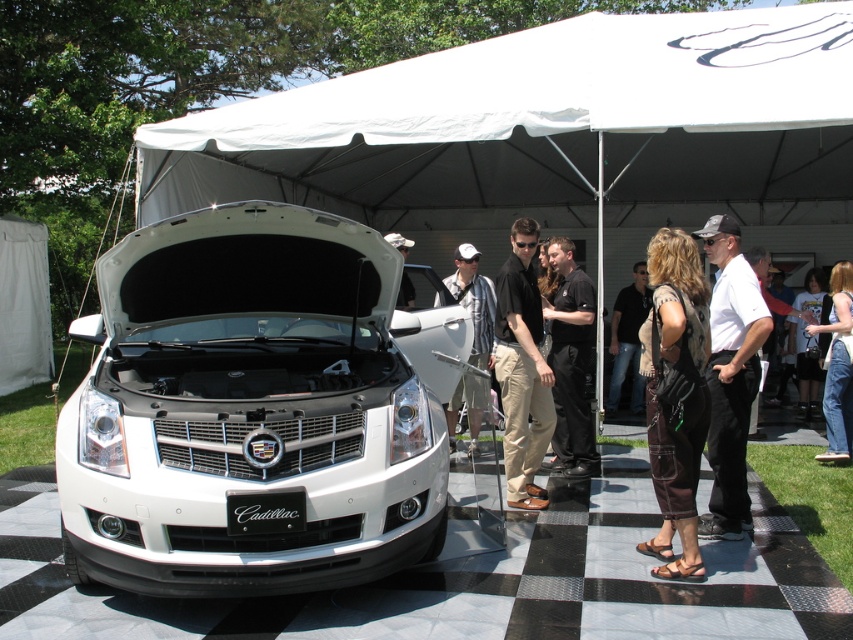
Which is in front, point (218, 484) or point (556, 241)?

Positioned in front is point (218, 484).

Where is `white glossy car at center`? Image resolution: width=853 pixels, height=640 pixels. white glossy car at center is located at coordinates (248, 412).

Measure the distance between point [260,518] and camera.

The distance of point [260,518] from camera is 3.64 meters.

You are a GUI agent. You are given a task and a screenshot of the screen. Output one action in this format:
    pyautogui.click(x=<x>, y=<y>)
    Task: Click on the white glossy car at center
    This screenshot has height=640, width=853.
    Given the screenshot: What is the action you would take?
    pyautogui.click(x=248, y=412)

Is white glossy car at center wider than black cotton shirt at center?

Yes, white glossy car at center is wider than black cotton shirt at center.

Where is `white glossy car at center`? This screenshot has width=853, height=640. white glossy car at center is located at coordinates (248, 412).

The image size is (853, 640). Identify the location of white glossy car at center. (248, 412).

Does black cotton shirt at center come behind plaid shirt at center?

No, it is not.

Which is more to the right, black cotton shirt at center or plaid shirt at center?

black cotton shirt at center

The width and height of the screenshot is (853, 640). In order to click on black cotton shirt at center in this screenshot , I will do `click(521, 369)`.